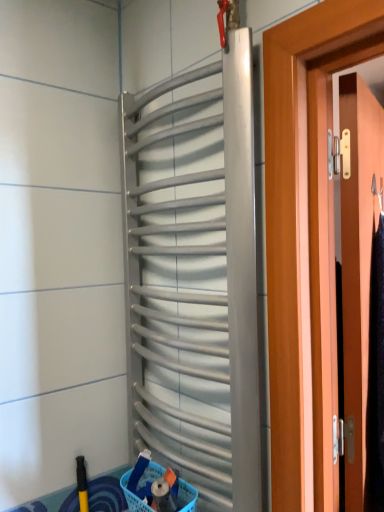
Question: Should I look upward or downward to see silver metallic radiator at center?

Choices:
 (A) down
 (B) up

Answer: (A)

Question: Is yellow rubber brush at lower left oriented away from silver metallic radiator at center?

Choices:
 (A) yes
 (B) no

Answer: (B)

Question: From the image's perspective, is yellow rubber brush at lower left under silver metallic radiator at center?

Choices:
 (A) no
 (B) yes

Answer: (B)

Question: Is yellow rubber brush at lower left closer to the viewer compared to silver metallic radiator at center?

Choices:
 (A) yes
 (B) no

Answer: (B)

Question: Does yellow rubber brush at lower left have a larger size compared to silver metallic radiator at center?

Choices:
 (A) no
 (B) yes

Answer: (A)

Question: Does yellow rubber brush at lower left have a greater height compared to silver metallic radiator at center?

Choices:
 (A) no
 (B) yes

Answer: (A)

Question: Is yellow rubber brush at lower left aimed at silver metallic radiator at center?

Choices:
 (A) no
 (B) yes

Answer: (A)

Question: Is wooden door at right bigger than silver metallic radiator at center?

Choices:
 (A) yes
 (B) no

Answer: (A)

Question: Considering the relative sizes of wooden door at right and silver metallic radiator at center in the image provided, is wooden door at right wider than silver metallic radiator at center?

Choices:
 (A) yes
 (B) no

Answer: (B)

Question: Is wooden door at right oriented towards silver metallic radiator at center?

Choices:
 (A) no
 (B) yes

Answer: (A)

Question: Does wooden door at right have a lesser width compared to silver metallic radiator at center?

Choices:
 (A) no
 (B) yes

Answer: (B)

Question: From the image's perspective, would you say wooden door at right is shown under silver metallic radiator at center?

Choices:
 (A) yes
 (B) no

Answer: (A)

Question: Is wooden door at right to the right of silver metallic radiator at center from the viewer's perspective?

Choices:
 (A) yes
 (B) no

Answer: (A)

Question: Is yellow rubber brush at lower left smaller than blue plastic basket at lower center?

Choices:
 (A) no
 (B) yes

Answer: (B)